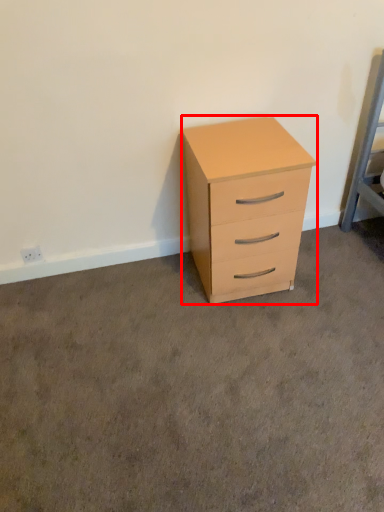
Question: From the image's perspective, what is the correct spatial positioning of chest of drawers (annotated by the red box) in reference to concrete?

Choices:
 (A) below
 (B) above

Answer: (B)